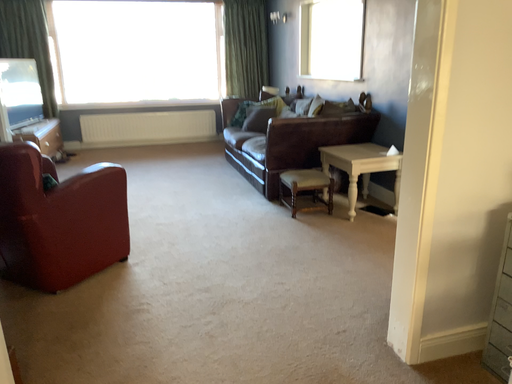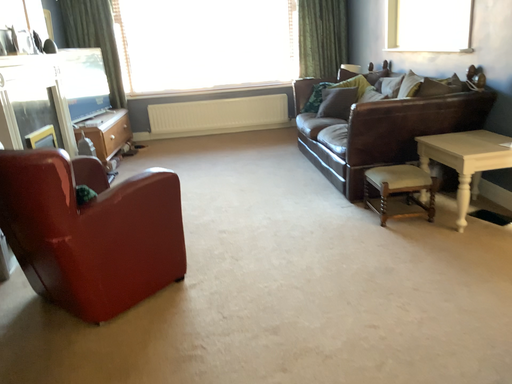
Question: Which way did the camera rotate in the video?

Choices:
 (A) rotated right
 (B) rotated left

Answer: (B)